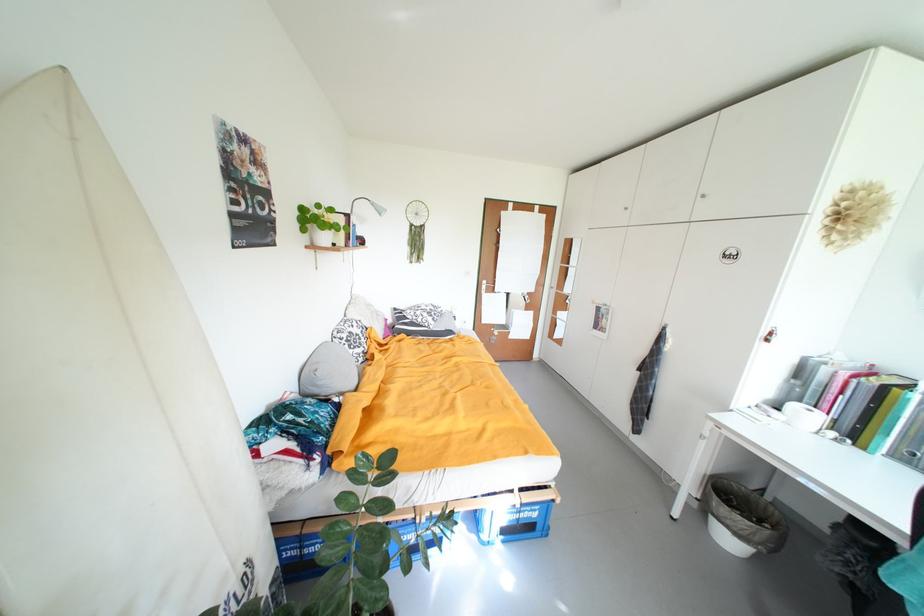
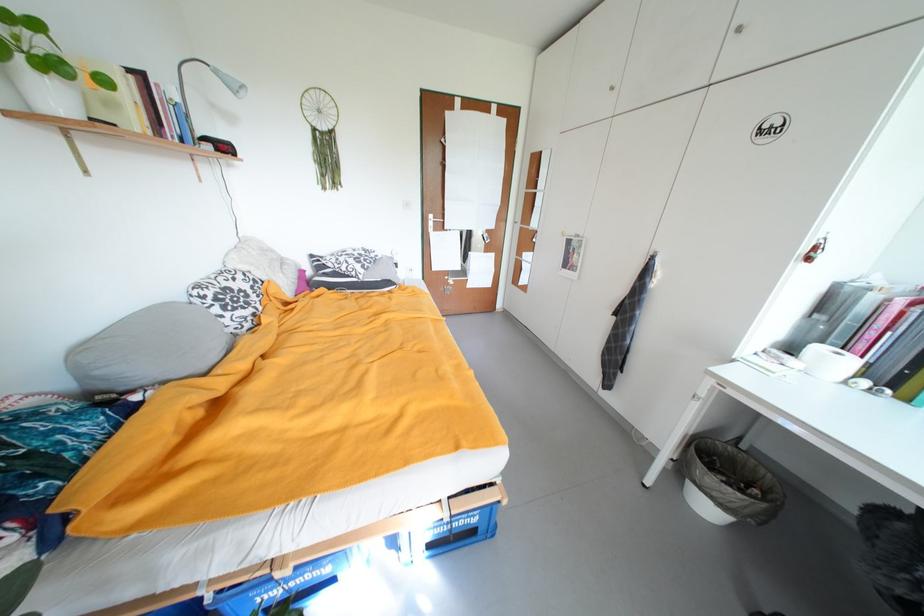
Locate, in the second image, the point that corresponds to [387,213] in the first image.

(244, 90)